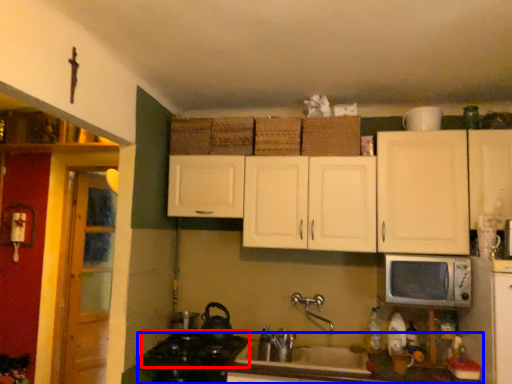
Question: Among these objects, which one is farthest to the camera, gas stove (highlighted by a red box) or countertop (highlighted by a blue box)?

Choices:
 (A) gas stove
 (B) countertop

Answer: (A)